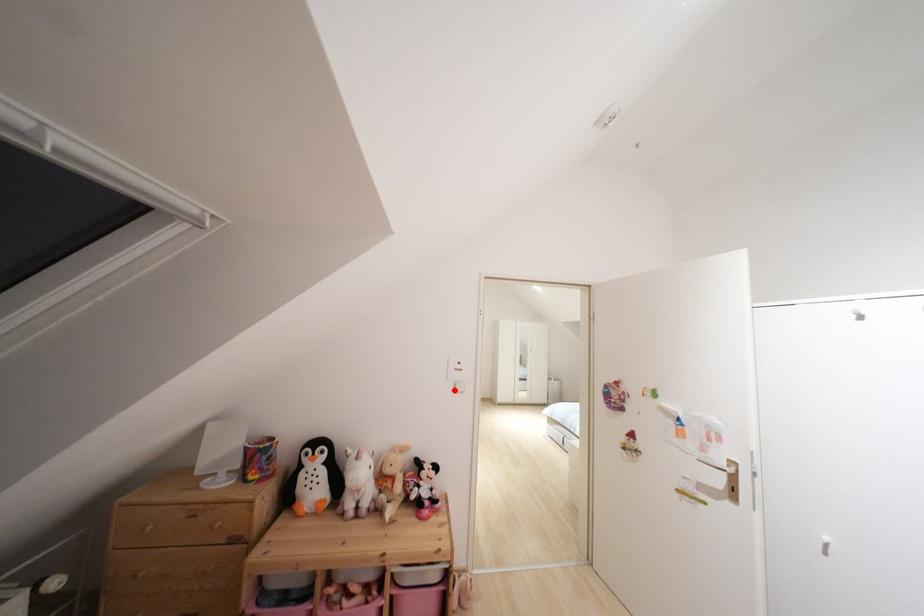
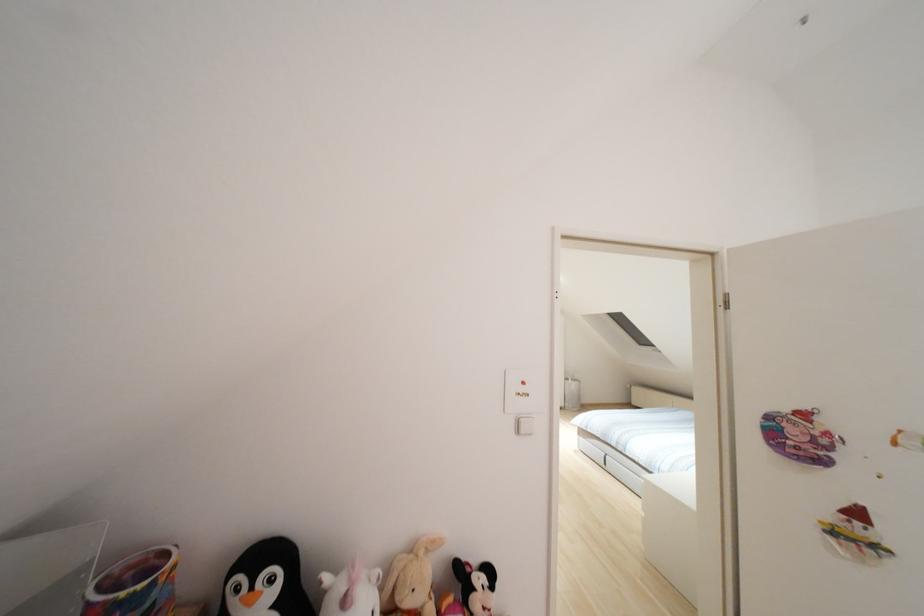
Find the pixel in the second image that matches the highlighted location in the first image.

(517, 431)